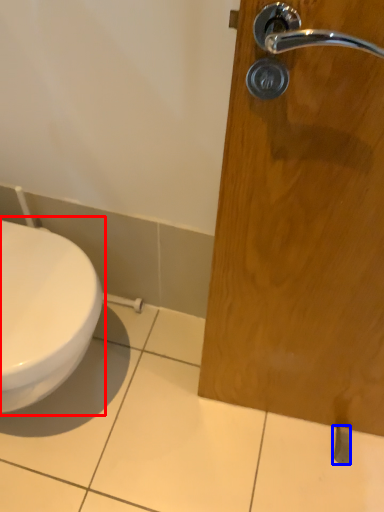
Question: Which object is further to the camera taking this photo, toilet (highlighted by a red box) or door handle (highlighted by a blue box)?

Choices:
 (A) toilet
 (B) door handle

Answer: (B)